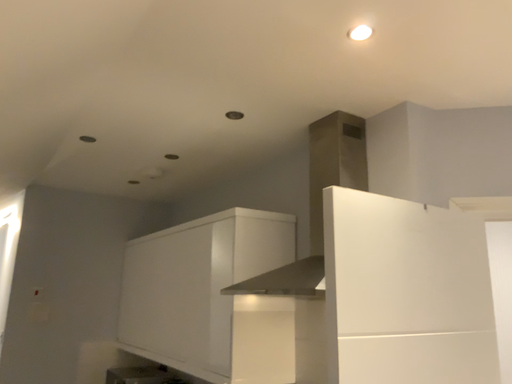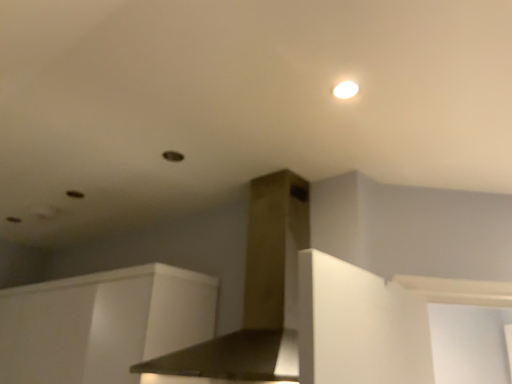
Question: How did the camera likely rotate when shooting the video?

Choices:
 (A) rotated right
 (B) rotated left

Answer: (A)